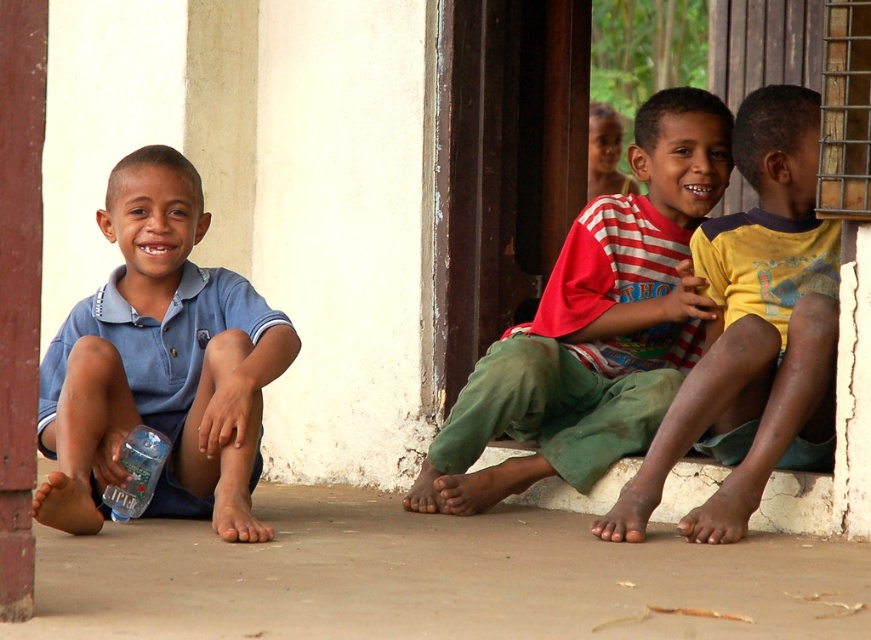
Between point (741, 424) and point (140, 436), which one is positioned behind?

The point (741, 424) is behind.

Does point (767, 182) come in front of point (154, 460)?

No, it is behind (154, 460).

Is point (714, 522) less distant than point (109, 499)?

That is True.

The height and width of the screenshot is (640, 871). What are the coordinates of `yellow cotton shirt at center` in the screenshot? It's located at (754, 333).

Who is positioned more to the right, red striped shirt at center or blue cotton shirt at left?

Positioned to the right is red striped shirt at center.

Does red striped shirt at center appear over blue cotton shirt at left?

Yes.

Between point (595, 212) and point (191, 369), which one is positioned behind?

The point (595, 212) is more distant.

Locate an element on the screen. red striped shirt at center is located at coordinates (596, 324).

Does red striped shirt at center have a lesser height compared to clear plastic bottle at lower left?

In fact, red striped shirt at center may be taller than clear plastic bottle at lower left.

Locate an element on the screen. This screenshot has height=640, width=871. red striped shirt at center is located at coordinates click(596, 324).

Between point (640, 204) and point (156, 440), which one is positioned in front?

Point (156, 440) is in front.

Where is `red striped shirt at center`? red striped shirt at center is located at coordinates (596, 324).